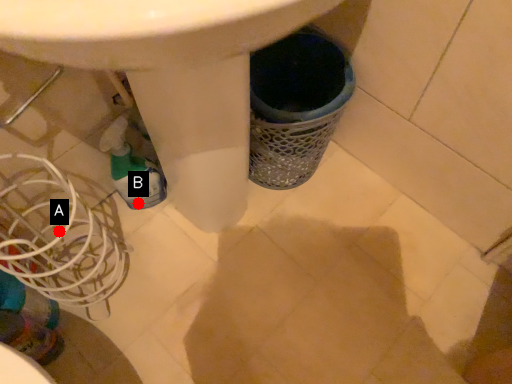
Question: Two points are circled on the image, labeled by A and B beside each circle. Which point appears closest to the camera in this image?

Choices:
 (A) A is closer
 (B) B is closer

Answer: (A)